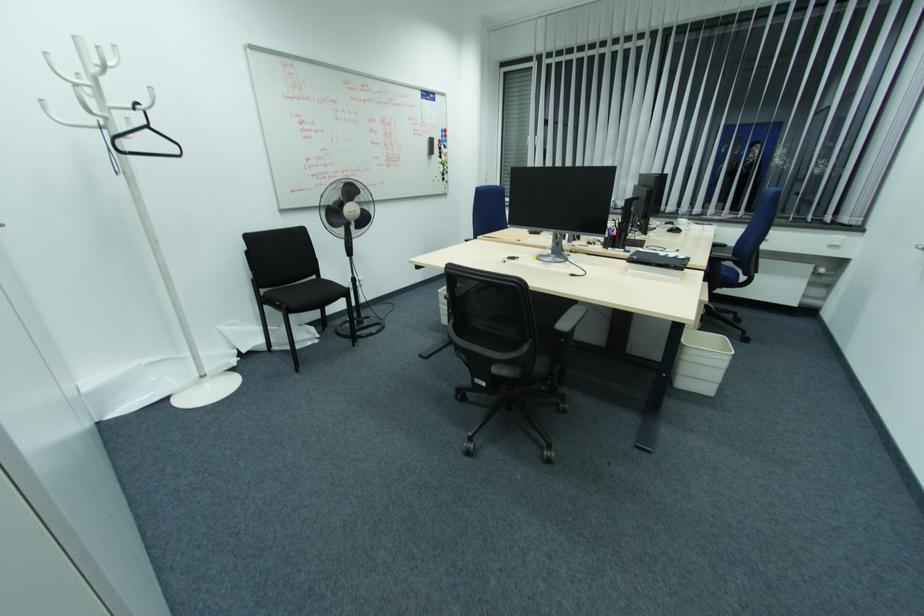
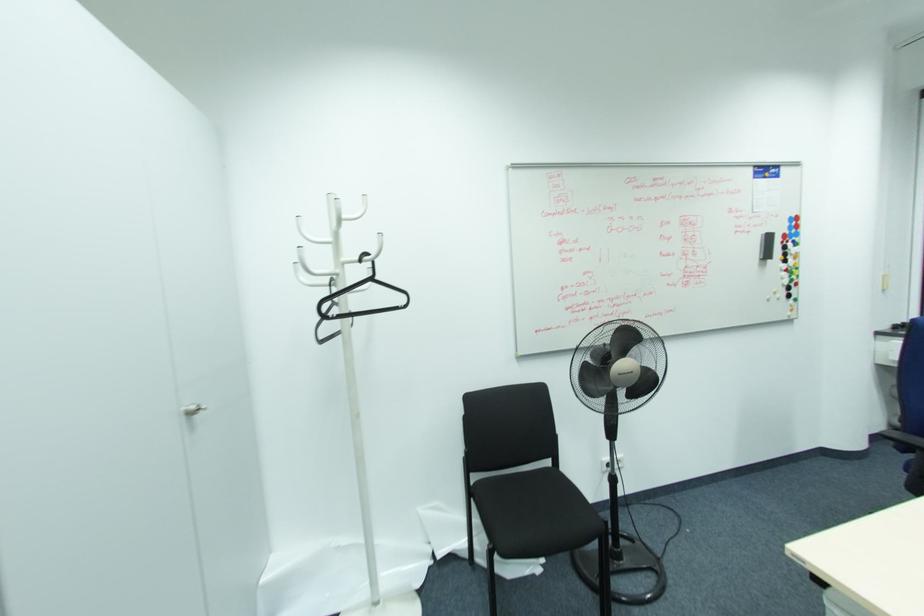
Where in the second image is the point corresponding to point 261,294 from the first image?

(472, 483)